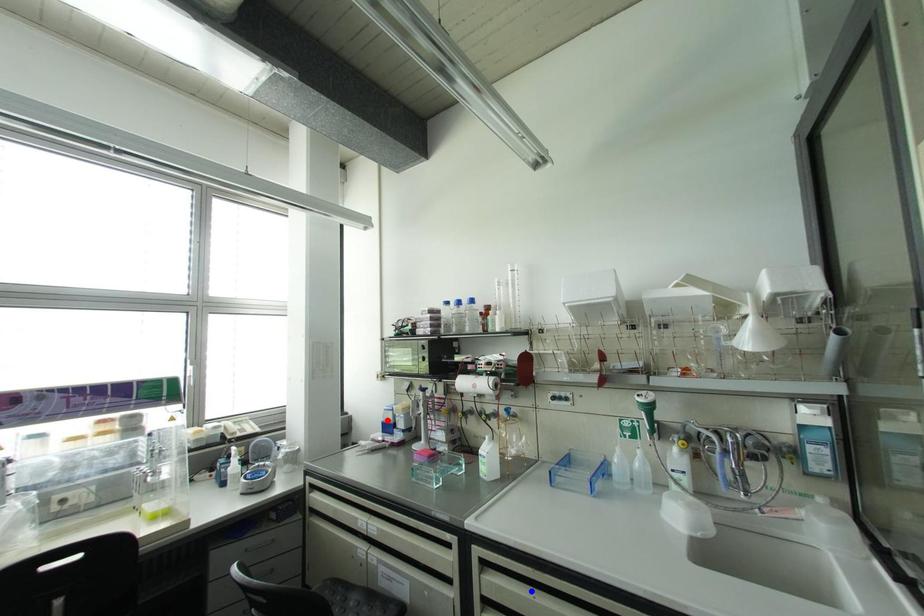
Question: Which of the two points in the image is closer to the camera?

Choices:
 (A) Blue point is closer.
 (B) Red point is closer.

Answer: (A)